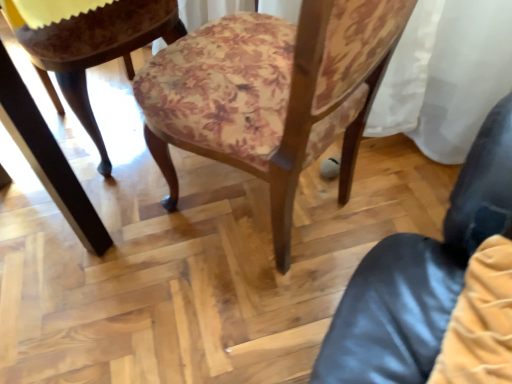
At what (x,y) coordinates should I click in order to perform the action: click on vacant area that lies to the right of floral fabric chair at center. Please return your answer as a coordinate pair (x, y). The image size is (512, 384). Looking at the image, I should click on (392, 186).